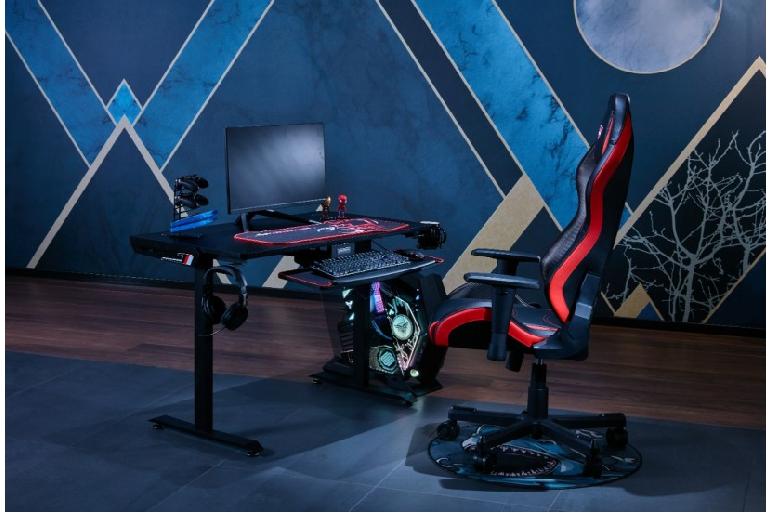
Identify the location of back of a gaming chair. (588, 249).